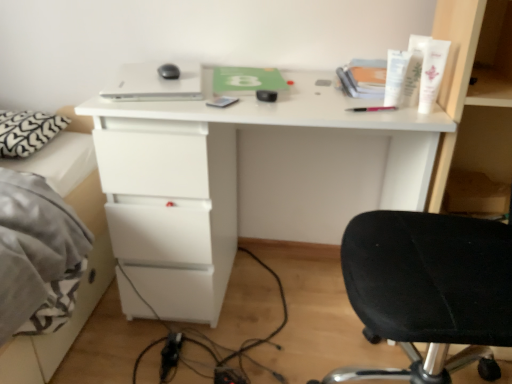
Identify the location of free space in front of matte gray notepad at center. This screenshot has height=384, width=512. (221, 111).